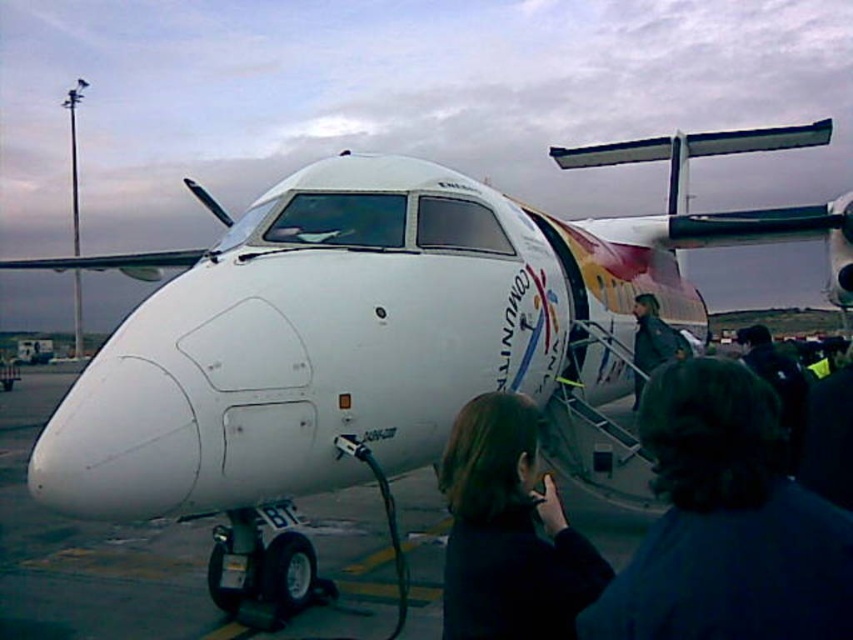
Which of these two, dark brown hair at lower center or dark blue jacket at center, stands shorter?

With less height is dark brown hair at lower center.

Locate an element on the screen. Image resolution: width=853 pixels, height=640 pixels. dark brown hair at lower center is located at coordinates (726, 522).

What do you see at coordinates (508, 531) in the screenshot? The height and width of the screenshot is (640, 853). I see `black matte jacket at lower center` at bounding box center [508, 531].

Who is shorter, black matte jacket at lower center or dark blue jacket at center?

black matte jacket at lower center is shorter.

Is point (445, 595) farther from camera compared to point (654, 353)?

That is False.

Find the location of `black matte jacket at lower center`. black matte jacket at lower center is located at coordinates (508, 531).

Between dark brown hair at lower center and black matte jacket at lower center, which one appears on the right side from the viewer's perspective?

From the viewer's perspective, dark brown hair at lower center appears more on the right side.

Is dark brown hair at lower center shorter than black matte jacket at lower center?

Yes, dark brown hair at lower center is shorter than black matte jacket at lower center.

Between point (749, 570) and point (543, 522), which one is positioned behind?

Point (543, 522)

Where is `dark brown hair at lower center`? Image resolution: width=853 pixels, height=640 pixels. dark brown hair at lower center is located at coordinates (726, 522).